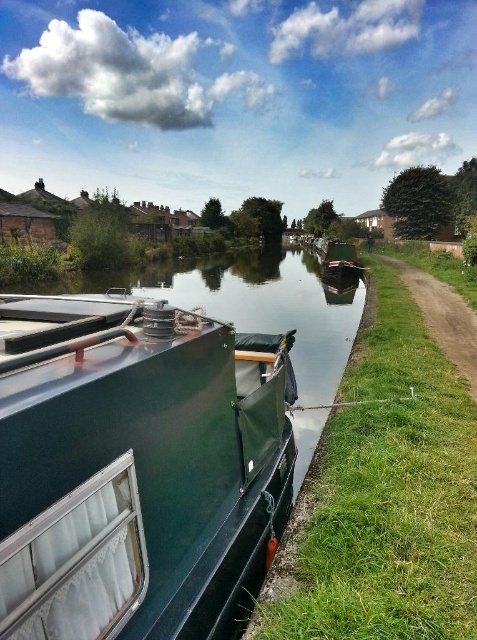
Can you confirm if green rubber boat at center is positioned above dirt path at right?

No, green rubber boat at center is not above dirt path at right.

Which is in front, point (395, 605) or point (433, 326)?

Point (395, 605) is more forward.

You are a GUI agent. You are given a task and a screenshot of the screen. Output one action in this format:
    pyautogui.click(x=<x>, y=<y>)
    Task: Click on the green rubber boat at center
    The image size is (477, 640).
    Given the screenshot: What is the action you would take?
    pyautogui.click(x=384, y=497)

From the picture: Is green glossy boat at center wider than green matte boat at center?

Yes.

Does green glossy boat at center appear over green matte boat at center?

Actually, green glossy boat at center is below green matte boat at center.

Which is behind, point (352, 298) or point (344, 248)?

Point (344, 248)

What are the coordinates of `green glossy boat at center` in the screenshot? It's located at (275, 308).

Does green matte boat at lower left have a larger size compared to green matte boat at center?

Actually, green matte boat at lower left might be smaller than green matte boat at center.

Describe the element at coordinates (136, 467) in the screenshot. The width and height of the screenshot is (477, 640). I see `green matte boat at lower left` at that location.

What are the coordinates of `green matte boat at lower left` in the screenshot? It's located at [136, 467].